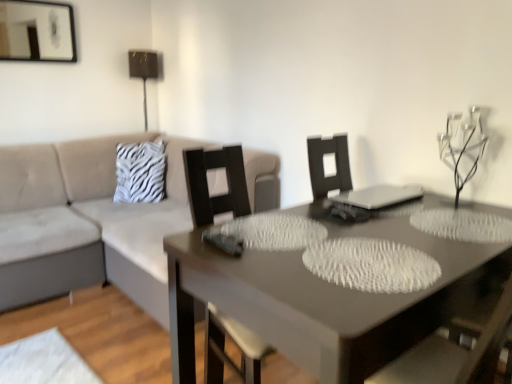
Question: Is white zebra print pillow at upper left oriented towards clear glass candle holder at upper right?

Choices:
 (A) no
 (B) yes

Answer: (A)

Question: Is white zebra print pillow at upper left far from clear glass candle holder at upper right?

Choices:
 (A) no
 (B) yes

Answer: (B)

Question: Does white zebra print pillow at upper left appear on the left side of clear glass candle holder at upper right?

Choices:
 (A) yes
 (B) no

Answer: (A)

Question: From a real-world perspective, is white zebra print pillow at upper left physically above clear glass candle holder at upper right?

Choices:
 (A) no
 (B) yes

Answer: (A)

Question: Does white zebra print pillow at upper left have a lesser width compared to clear glass candle holder at upper right?

Choices:
 (A) no
 (B) yes

Answer: (B)

Question: Is white zebra print pillow at upper left smaller than clear glass candle holder at upper right?

Choices:
 (A) no
 (B) yes

Answer: (A)

Question: Is beige fabric couch at left positioned behind clear glass candle holder at upper right?

Choices:
 (A) yes
 (B) no

Answer: (A)

Question: Is beige fabric couch at left positioned beyond the bounds of clear glass candle holder at upper right?

Choices:
 (A) no
 (B) yes

Answer: (B)

Question: Can you confirm if beige fabric couch at left is shorter than clear glass candle holder at upper right?

Choices:
 (A) yes
 (B) no

Answer: (B)

Question: Is beige fabric couch at left oriented away from clear glass candle holder at upper right?

Choices:
 (A) no
 (B) yes

Answer: (A)

Question: Does beige fabric couch at left have a lesser width compared to clear glass candle holder at upper right?

Choices:
 (A) no
 (B) yes

Answer: (A)

Question: Considering the relative positions of beige fabric couch at left and clear glass candle holder at upper right in the image provided, is beige fabric couch at left to the right of clear glass candle holder at upper right from the viewer's perspective?

Choices:
 (A) yes
 (B) no

Answer: (B)

Question: Is beige fabric couch at left facing away from smooth gray table at center?

Choices:
 (A) no
 (B) yes

Answer: (A)